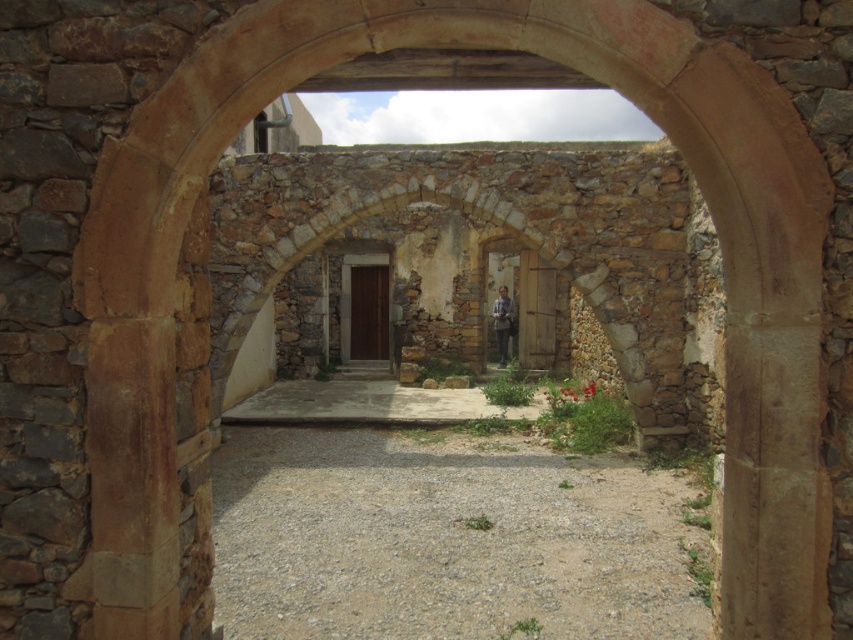
You are standing in the courtyard and want to walk towards the archway. There are two points marked on the ground, point (660, 570) and point (230, 410). Which point is closer to you?

Point (660, 570) is closer to the viewer than point (230, 410), so the closer point to you is point (660, 570).

You are standing at the entrance of the rustic stone structure and want to walk to the center of the courtyard. You notice there are two paths available. One is the gray gravel at center and the other is the smooth concrete path at center. Which path is located to the left when facing the courtyard?

The smooth concrete path at center is to the left because the gray gravel at center is to its right.